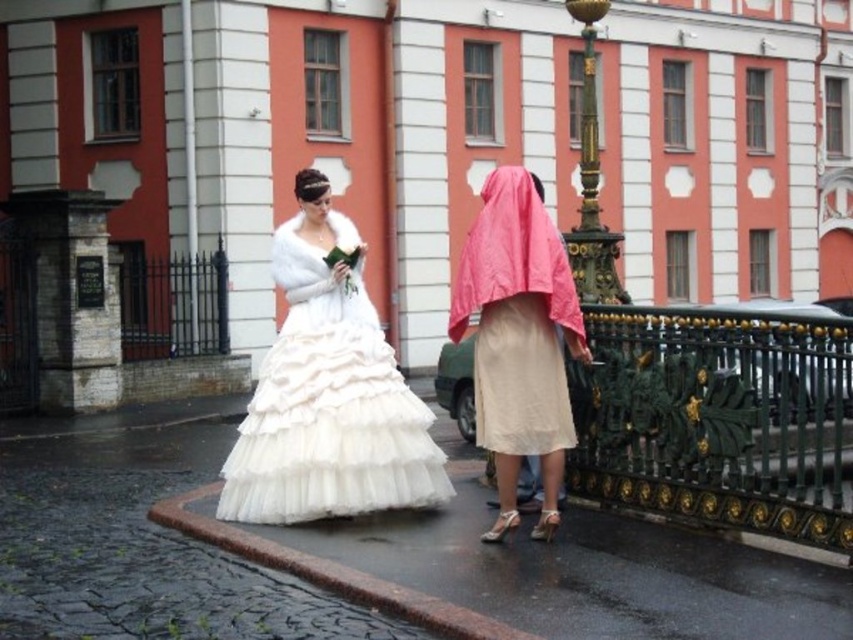
Is point (843, 336) positioned behind point (314, 426)?

No, it is not.

Does green wrought iron fence at lower right have a smaller size compared to white tulle dress at center?

No, green wrought iron fence at lower right is not smaller than white tulle dress at center.

Does point (828, 348) come farther from viewer compared to point (311, 396)?

That is False.

Where is `green wrought iron fence at lower right`? green wrought iron fence at lower right is located at coordinates (718, 419).

Is point (242, 504) positioned before point (584, 109)?

Yes.

Is point (381, 460) more distant than point (583, 221)?

That is False.

What do you see at coordinates (328, 406) in the screenshot? This screenshot has width=853, height=640. I see `white tulle dress at center` at bounding box center [328, 406].

Where is `white tulle dress at center`? white tulle dress at center is located at coordinates (328, 406).

Does pink fabric robe at center appear on the left side of gold polished metal lamp post at upper center?

Correct, you'll find pink fabric robe at center to the left of gold polished metal lamp post at upper center.

Measure the distance from pink fabric robe at center to gold polished metal lamp post at upper center.

pink fabric robe at center and gold polished metal lamp post at upper center are 39.95 feet apart from each other.

Is point (508, 412) positioned before point (590, 253)?

Yes, point (508, 412) is in front of point (590, 253).

You are a GUI agent. You are given a task and a screenshot of the screen. Output one action in this format:
    pyautogui.click(x=<x>, y=<y>)
    Task: Click on the pink fabric robe at center
    
    Given the screenshot: What is the action you would take?
    pyautogui.click(x=517, y=317)